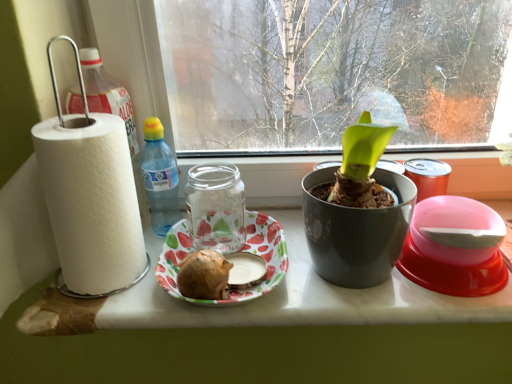
The image size is (512, 384). What do you see at coordinates (204, 275) in the screenshot? I see `brown matte potato at center` at bounding box center [204, 275].

Locate an element on the screen. The width and height of the screenshot is (512, 384). translucent plastic bottle at center is located at coordinates (159, 177).

Describe the element at coordinates (453, 248) in the screenshot. I see `pink plastic bowl at right` at that location.

This screenshot has width=512, height=384. Find the location of `brown matte potato at center`. brown matte potato at center is located at coordinates (204, 275).

Locate an element on the screen. The width and height of the screenshot is (512, 384). food on the right side of translucent plastic bottle at center is located at coordinates (204, 275).

Does point (154, 152) come farther from viewer compared to point (206, 254)?

Yes, it is behind point (206, 254).

From a real-world perspective, which object rests below the other?

brown matte potato at center.

From their relative heights in the image, would you say translucent plastic bottle at center is taller or shorter than brown matte potato at center?

Considering their sizes, translucent plastic bottle at center has more height than brown matte potato at center.

Consider the image. From their relative heights in the image, would you say strawberry-patterned paper plate at center is taller or shorter than brown matte potato at center?

Considering their sizes, strawberry-patterned paper plate at center has less height than brown matte potato at center.

In the scene shown: From a real-world perspective, between strawberry-patterned paper plate at center and brown matte potato at center, who is vertically lower?

In real-world perspective, strawberry-patterned paper plate at center is lower.

Is strawberry-patterned paper plate at center oriented towards brown matte potato at center?

Yes, strawberry-patterned paper plate at center is facing brown matte potato at center.

Which is more distant, (x=179, y=287) or (x=218, y=200)?

Point (x=218, y=200)

Is brown matte potato at center bigger or smaller than transparent glass jar at center?

Considering their sizes, brown matte potato at center takes up less space than transparent glass jar at center.

Are brown matte potato at center and transparent glass jar at center located far from each other?

No, brown matte potato at center is in close proximity to transparent glass jar at center.

Who is shorter, brown matte potato at center or transparent glass jar at center?

With less height is brown matte potato at center.

From a real-world perspective, is white paper towel at left physically below pink plastic bowl at right?

Indeed, from a real-world perspective, white paper towel at left is positioned beneath pink plastic bowl at right.

Which is behind, point (205, 357) or point (453, 242)?

Positioned behind is point (205, 357).

Is white paper towel at left facing towards pink plastic bowl at right?

No, white paper towel at left is not oriented towards pink plastic bowl at right.

From the image's perspective, is translucent plastic bottle at center over transparent glass jar at center?

Yes, from the image's perspective, translucent plastic bottle at center is on top of transparent glass jar at center.

Could you tell me if translucent plastic bottle at center is facing transparent glass jar at center?

No, translucent plastic bottle at center does not turn towards transparent glass jar at center.

Identify the location of bottle on the left of transparent glass jar at center. Image resolution: width=512 pixels, height=384 pixels. (159, 177).

Is transparent glass jar at center completely or partially outside of brown matte potato at center?

Yes, transparent glass jar at center is located beyond the bounds of brown matte potato at center.

Which is in front, transparent glass jar at center or brown matte potato at center?

Positioned in front is brown matte potato at center.

Is transparent glass jar at center at the right side of brown matte potato at center?

No.

In the scene shown: From their relative heights in the image, would you say transparent glass jar at center is taller or shorter than brown matte potato at center?

transparent glass jar at center is taller than brown matte potato at center.

Is point (221, 305) positioned in front of point (217, 217)?

Yes, it is in front of point (217, 217).

Can you confirm if strawberry-patterned paper plate at center is positioned to the right of transparent glass jar at center?

Yes, strawberry-patterned paper plate at center is to the right of transparent glass jar at center.

Is strawberry-patterned paper plate at center turned away from transparent glass jar at center?

Yes, strawberry-patterned paper plate at center is facing away from transparent glass jar at center.

You are a GUI agent. You are given a task and a screenshot of the screen. Output one action in this format:
    pyautogui.click(x=<x>, y=<y>)
    Task: Click on the bottle behind the brown matte potato at center
    
    Given the screenshot: What is the action you would take?
    pos(159,177)

Find the location of `food lying on the left of strawberry-patterned paper plate at center`. food lying on the left of strawberry-patterned paper plate at center is located at coordinates (204, 275).

Based on the photo, from the image, which object appears to be nearer to strawberry-patterned paper plate at center, white paper towel at left or white paper at left?

white paper at left.

Which object lies further to the anchor point strawberry-patterned paper plate at center, transparent glass jar at center or brown matte potato at center?

Among the two, brown matte potato at center is located further to strawberry-patterned paper plate at center.

When comparing their distances from transparent glass jar at center, does strawberry-patterned paper plate at center or translucent plastic bottle at center seem closer?

The object closer to transparent glass jar at center is strawberry-patterned paper plate at center.

Based on their spatial positions, is translucent plastic bottle at center or transparent glass jar at center closer to pink plastic bowl at right?

Based on the image, transparent glass jar at center appears to be nearer to pink plastic bowl at right.

Considering their positions, is brown matte potato at center positioned further to strawberry-patterned paper plate at center than transparent glass jar at center?

brown matte potato at center lies further to strawberry-patterned paper plate at center than the other object.

Looking at the image, which one is located closer to strawberry-patterned paper plate at center, brown matte potato at center or pink plastic bowl at right?

brown matte potato at center is closer to strawberry-patterned paper plate at center.

Based on their spatial positions, is brown matte potato at center or white paper at left further from white paper towel at left?

brown matte potato at center lies further to white paper towel at left than the other object.

Estimate the real-world distances between objects in this image. Which object is closer to white paper at left, white paper towel at left or transparent glass jar at center?

transparent glass jar at center is positioned closer to the anchor white paper at left.

Locate an element on the screen. This screenshot has width=512, height=384. glass jar between white paper at left and white paper towel at left from left to right is located at coordinates pyautogui.click(x=216, y=207).

Where is `table between translucent plastic bottle at center and pink plastic bowl at right in the horizontal direction`? The width and height of the screenshot is (512, 384). table between translucent plastic bottle at center and pink plastic bowl at right in the horizontal direction is located at coordinates (270, 335).

Where is `platter between transparent glass jar at center and white paper towel at left in the horizontal direction`? Image resolution: width=512 pixels, height=384 pixels. platter between transparent glass jar at center and white paper towel at left in the horizontal direction is located at coordinates (241, 250).

This screenshot has height=384, width=512. What are the coordinates of `platter between translucent plastic bottle at center and brown matte potato at center in the vertical direction` in the screenshot? It's located at (241, 250).